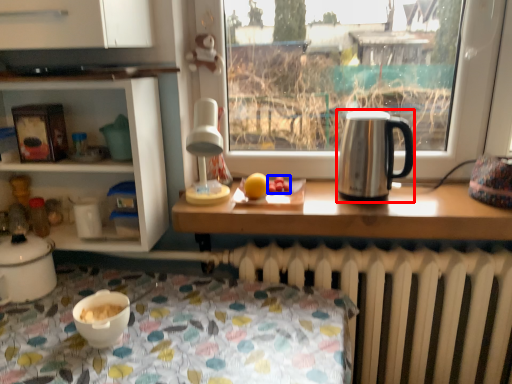
Question: Which object appears farthest to the camera in this image, kettle (highlighted by a red box) or food (highlighted by a blue box)?

Choices:
 (A) kettle
 (B) food

Answer: (B)